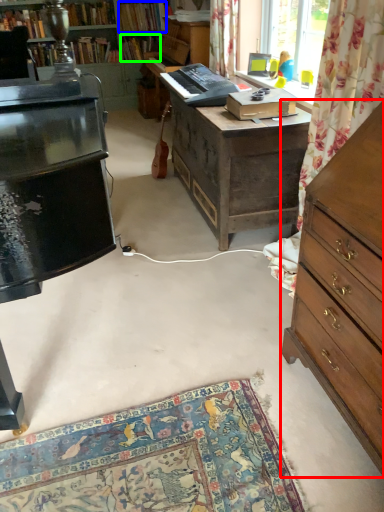
Question: Estimate the real-world distances between objects in this image. Which object is farther from chest of drawers (highlighted by a red box), book (highlighted by a blue box) or book (highlighted by a green box)?

Choices:
 (A) book
 (B) book

Answer: (B)